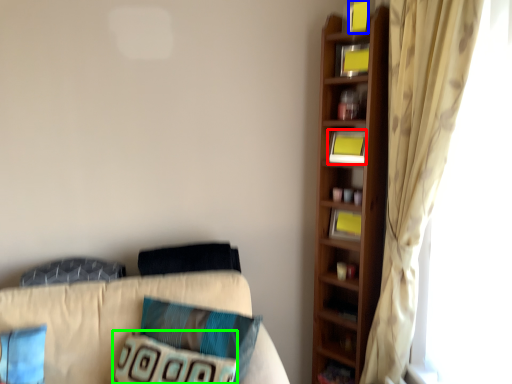
Question: Based on their relative distances, which object is farther from book (highlighted by a red box)? Choose from book (highlighted by a blue box) and pillow (highlighted by a green box).

Choices:
 (A) book
 (B) pillow

Answer: (B)